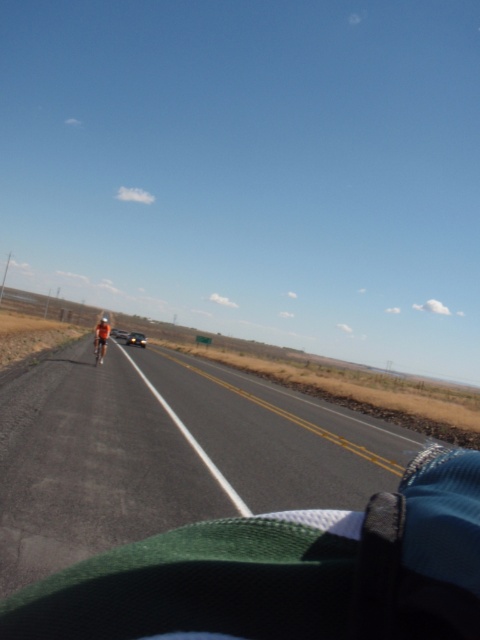
Is orange fabric bicycle at center below metallic silver car at center?

No, orange fabric bicycle at center is not below metallic silver car at center.

How far apart are orange fabric bicycle at center and metallic silver car at center?

orange fabric bicycle at center is 29.59 meters away from metallic silver car at center.

Between point (104, 340) and point (127, 344), which one is positioned in front?

Positioned in front is point (104, 340).

Where is `orange fabric bicycle at center`? The image size is (480, 640). orange fabric bicycle at center is located at coordinates (99, 349).

This screenshot has width=480, height=640. What do you see at coordinates (166, 454) in the screenshot? I see `asphalt road at center` at bounding box center [166, 454].

Does asphalt road at center have a greater width compared to orange fabric bicycle at center?

Indeed, asphalt road at center has a greater width compared to orange fabric bicycle at center.

Which is in front, point (66, 470) or point (95, 355)?

Point (66, 470) is in front.

Image resolution: width=480 pixels, height=640 pixels. Find the location of `asphalt road at center`. asphalt road at center is located at coordinates (166, 454).

Can you confirm if asphalt road at center is positioned to the left of metallic silver car at center?

In fact, asphalt road at center is to the right of metallic silver car at center.

Which is behind, point (62, 396) or point (141, 333)?

The point (141, 333) is more distant.

Locate an element on the screen. asphalt road at center is located at coordinates (166, 454).

This screenshot has height=640, width=480. Find the location of `asphalt road at center`. asphalt road at center is located at coordinates (166, 454).